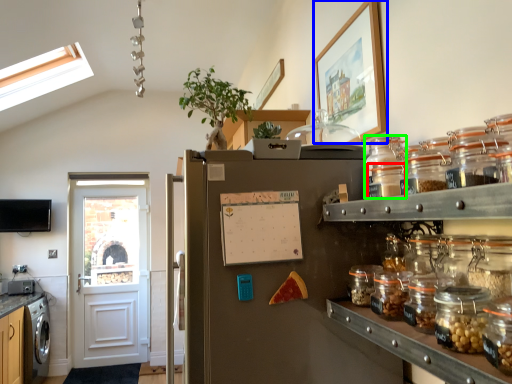
Question: Which is farther away from glass jar (highlighted by a red box)? picture frame (highlighted by a blue box) or glass jar (highlighted by a green box)?

Choices:
 (A) picture frame
 (B) glass jar

Answer: (A)